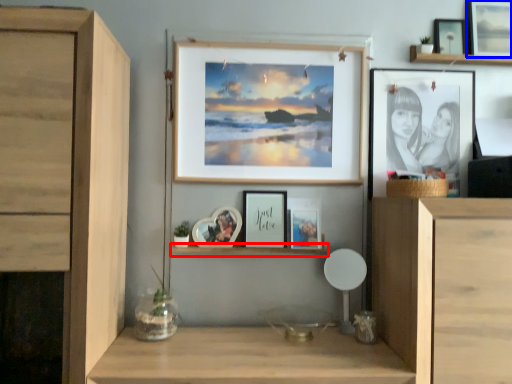
Question: Which object appears farthest to the camera in this image, shelf (highlighted by a red box) or picture frame (highlighted by a blue box)?

Choices:
 (A) shelf
 (B) picture frame

Answer: (B)